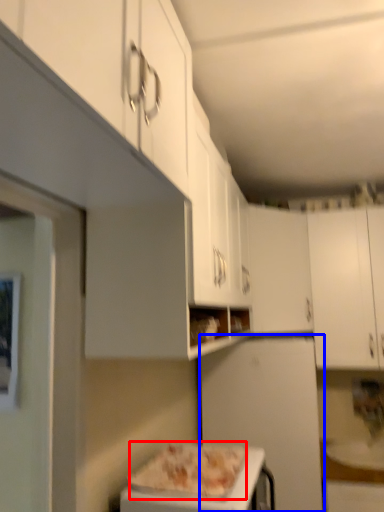
Question: Which of the following is the farthest to the observer, pizza (highlighted by a red box) or appliance (highlighted by a blue box)?

Choices:
 (A) pizza
 (B) appliance

Answer: (B)